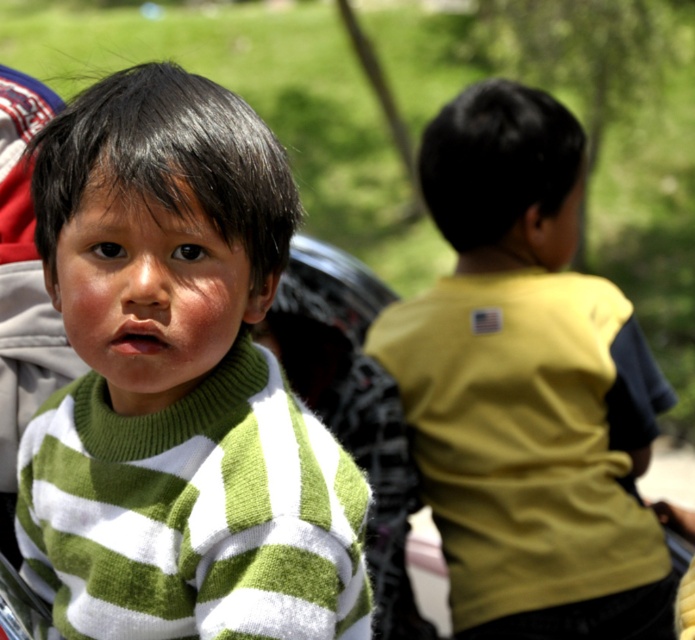
Which of these two, green striped sweater at center or yellow matte shirt at right, stands taller?

yellow matte shirt at right is taller.

Does green striped sweater at center have a lesser height compared to yellow matte shirt at right?

Indeed, green striped sweater at center has a lesser height compared to yellow matte shirt at right.

The width and height of the screenshot is (695, 640). Describe the element at coordinates (179, 384) in the screenshot. I see `green striped sweater at center` at that location.

The width and height of the screenshot is (695, 640). I want to click on green striped sweater at center, so click(x=179, y=384).